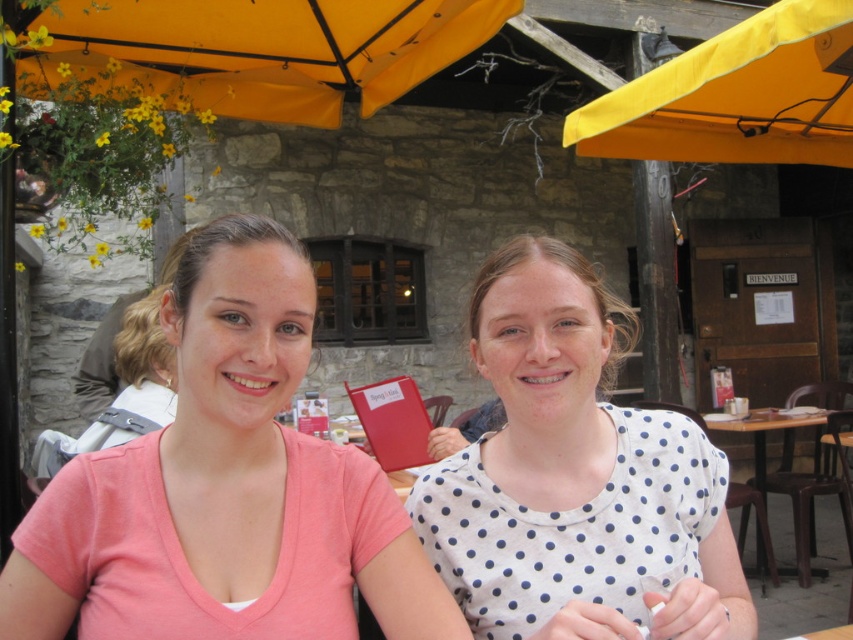
Question: Which of these objects is positioned farthest from the matte yellow umbrella at upper left?

Choices:
 (A) wooden table at lower right
 (B) yellow fabric canopy at upper center
 (C) matte pink shirt at center

Answer: (A)

Question: Which of the following is the farthest from the observer?

Choices:
 (A) (277, 376)
 (B) (780, 138)

Answer: (B)

Question: Is the position of matte pink shirt at center less distant than that of wooden table at lower right?

Choices:
 (A) no
 (B) yes

Answer: (B)

Question: Considering the real-world distances, which object is closest to the matte pink shirt at center?

Choices:
 (A) matte yellow umbrella at upper left
 (B) yellow fabric canopy at upper center
 (C) wooden table at lower right

Answer: (A)

Question: Is matte yellow umbrella at upper left positioned before yellow fabric canopy at upper center?

Choices:
 (A) yes
 (B) no

Answer: (A)

Question: Considering the relative positions of matte pink shirt at center and wooden table at lower right in the image provided, where is matte pink shirt at center located with respect to wooden table at lower right?

Choices:
 (A) below
 (B) above

Answer: (B)